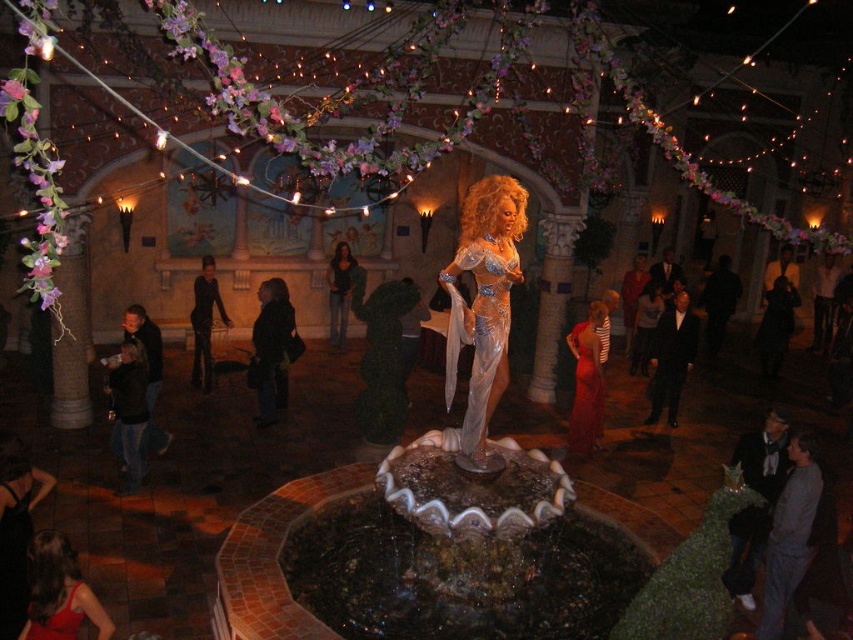
Question: Which of the following is the farthest from the observer?

Choices:
 (A) (67, 545)
 (B) (27, 636)
 (C) (339, 336)

Answer: (C)

Question: In this image, where is matte red dress at lower left located relative to shiny red dress at center?

Choices:
 (A) right
 (B) left

Answer: (B)

Question: Which point is closer to the camera taking this photo?

Choices:
 (A) (68, 561)
 (B) (35, 632)

Answer: (B)

Question: Considering the real-world distances, which object is closest to the translucent silver dress at center?

Choices:
 (A) matte red dress at lower left
 (B) dark brown leather jacket at center
 (C) shiny red dress at center

Answer: (A)

Question: Does shiny red dress at center have a lesser width compared to shiny red dress at lower left?

Choices:
 (A) no
 (B) yes

Answer: (A)

Question: Is translucent silver dress at center closer to camera compared to shiny red dress at center?

Choices:
 (A) no
 (B) yes

Answer: (B)